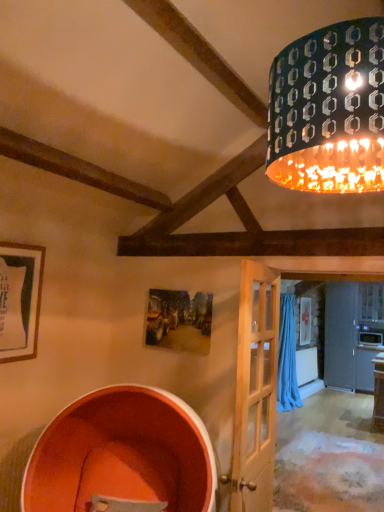
Question: Is light wood door at center thinner than orange matte barrel at lower left?

Choices:
 (A) no
 (B) yes

Answer: (B)

Question: From a real-world perspective, is light wood door at center located higher than orange matte barrel at lower left?

Choices:
 (A) no
 (B) yes

Answer: (B)

Question: Is light wood door at center facing away from orange matte barrel at lower left?

Choices:
 (A) yes
 (B) no

Answer: (A)

Question: From a real-world perspective, does light wood door at center sit lower than orange matte barrel at lower left?

Choices:
 (A) no
 (B) yes

Answer: (A)

Question: Is the position of light wood door at center more distant than that of orange matte barrel at lower left?

Choices:
 (A) no
 (B) yes

Answer: (B)

Question: In terms of height, does orange matte barrel at lower left look taller or shorter compared to metallic patterned shade at upper right?

Choices:
 (A) short
 (B) tall

Answer: (B)

Question: Based on their positions, is orange matte barrel at lower left located to the left or right of metallic patterned shade at upper right?

Choices:
 (A) right
 (B) left

Answer: (B)

Question: From a real-world perspective, is orange matte barrel at lower left physically located above or below metallic patterned shade at upper right?

Choices:
 (A) below
 (B) above

Answer: (A)

Question: Relative to metallic patterned shade at upper right, is orange matte barrel at lower left in front or behind?

Choices:
 (A) behind
 (B) front

Answer: (A)

Question: Based on their sizes in the image, would you say metallic patterned shade at upper right is bigger or smaller than orange matte barrel at lower left?

Choices:
 (A) small
 (B) big

Answer: (A)

Question: Is metallic patterned shade at upper right wider or thinner than orange matte barrel at lower left?

Choices:
 (A) thin
 (B) wide

Answer: (A)

Question: Based on their positions, is metallic patterned shade at upper right located to the left or right of orange matte barrel at lower left?

Choices:
 (A) left
 (B) right

Answer: (B)

Question: Is metallic patterned shade at upper right inside or outside of orange matte barrel at lower left?

Choices:
 (A) inside
 (B) outside

Answer: (B)

Question: Is light wood door at center to the left or to the right of metallic patterned shade at upper right in the image?

Choices:
 (A) left
 (B) right

Answer: (A)

Question: From a real-world perspective, relative to metallic patterned shade at upper right, is light wood door at center vertically above or below?

Choices:
 (A) below
 (B) above

Answer: (A)